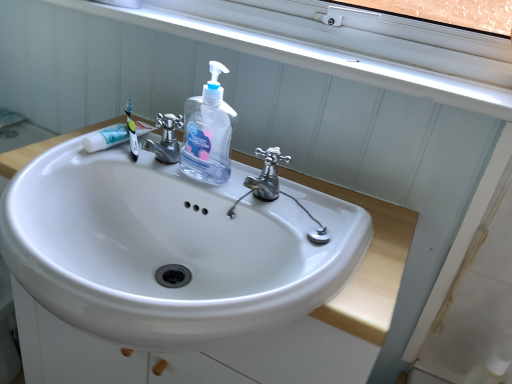
You are a GUI agent. You are given a task and a screenshot of the screen. Output one action in this format:
    pyautogui.click(x=<x>, y=<y>)
    Task: Click on the free location to the left of silver metallic faucet at center, which is the 2th tap in right-to-left order
    The width and height of the screenshot is (512, 384).
    Given the screenshot: What is the action you would take?
    pyautogui.click(x=76, y=160)